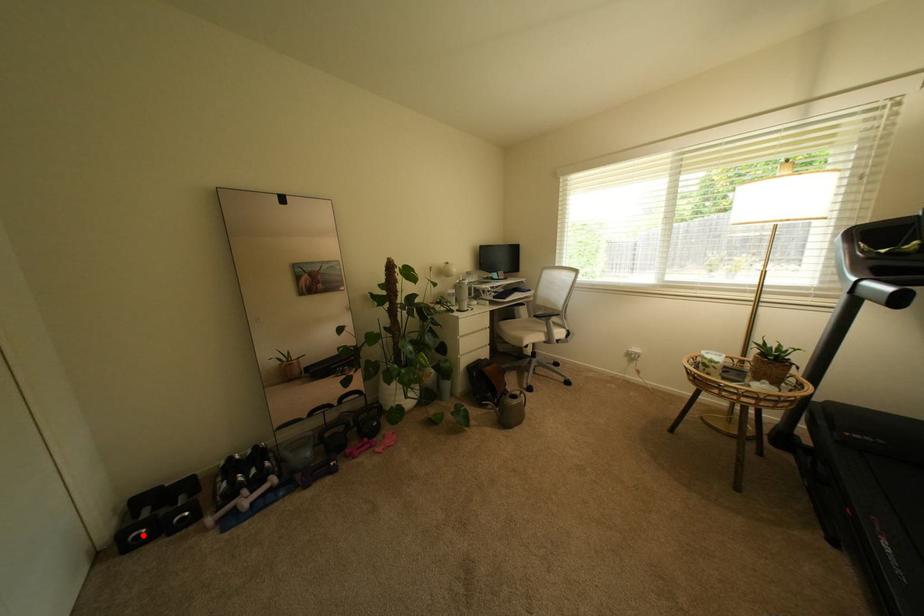
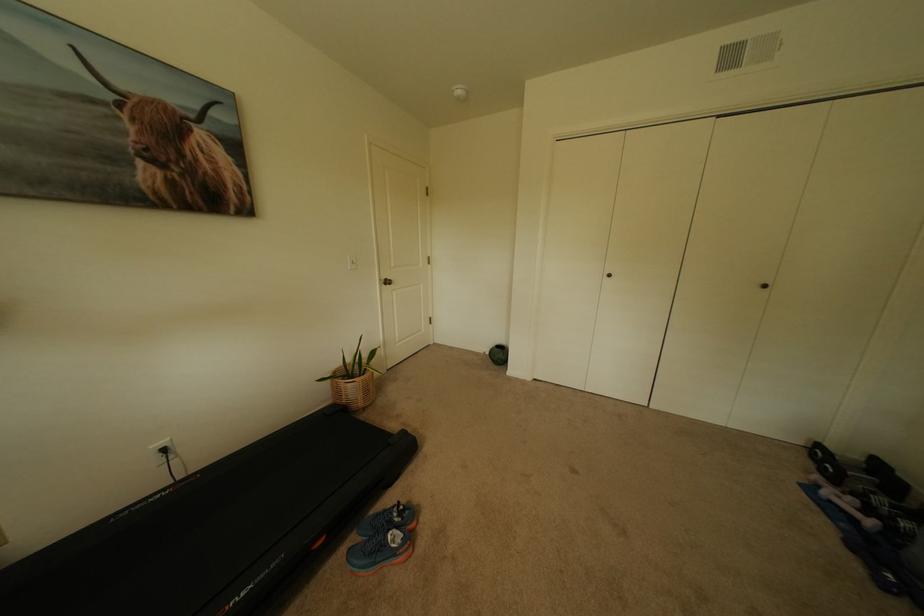
Find the pixel in the second image that matches the highlighted location in the first image.

(827, 452)